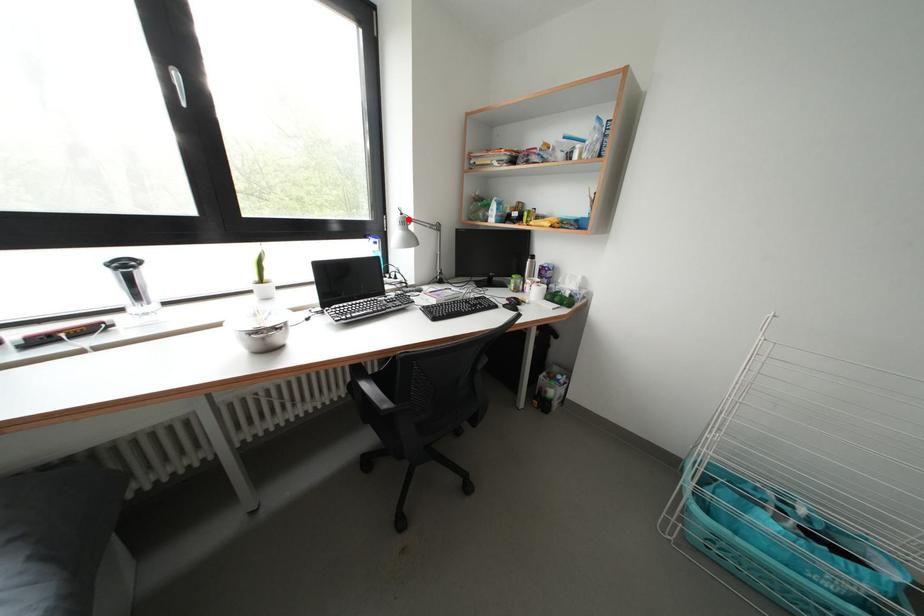
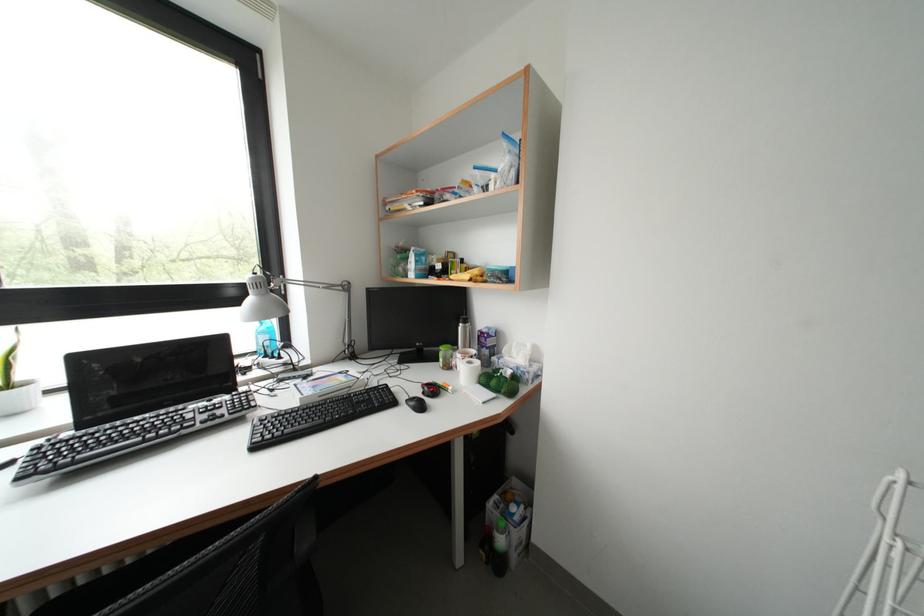
Locate, in the second image, the point that corresponds to the highlighted location in the first image.

(261, 278)